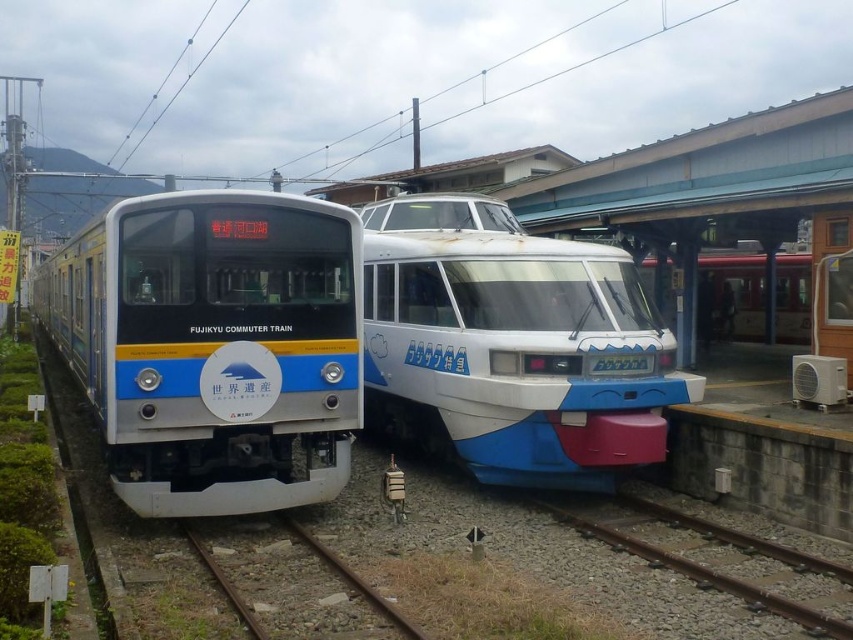
Locate an element on the screen. Image resolution: width=853 pixels, height=640 pixels. brown gravel train track at lower center is located at coordinates tap(703, 573).

Is brown gravel train track at lower center below brown gravel train track at center?

Indeed, brown gravel train track at lower center is positioned under brown gravel train track at center.

This screenshot has height=640, width=853. Identify the location of brown gravel train track at lower center. (703, 573).

The width and height of the screenshot is (853, 640). I want to click on brown gravel train track at lower center, so click(703, 573).

Does blue glossy train at center have a greater width compared to brown gravel train track at lower center?

No, blue glossy train at center is not wider than brown gravel train track at lower center.

From the picture: Who is more distant from viewer, (503, 256) or (622, 540)?

Positioned behind is point (503, 256).

Between point (433, 410) and point (844, 627), which one is positioned behind?

The point (433, 410) is behind.

The width and height of the screenshot is (853, 640). What are the coordinates of `blue glossy train at center` in the screenshot? It's located at (512, 344).

Can you confirm if white glossy commuter train at left is positioned below brown gravel train track at lower center?

Incorrect, white glossy commuter train at left is not positioned below brown gravel train track at lower center.

Is point (354, 218) closer to camera compared to point (643, 541)?

That is False.

Identify the location of white glossy commuter train at left. The image size is (853, 640). (213, 346).